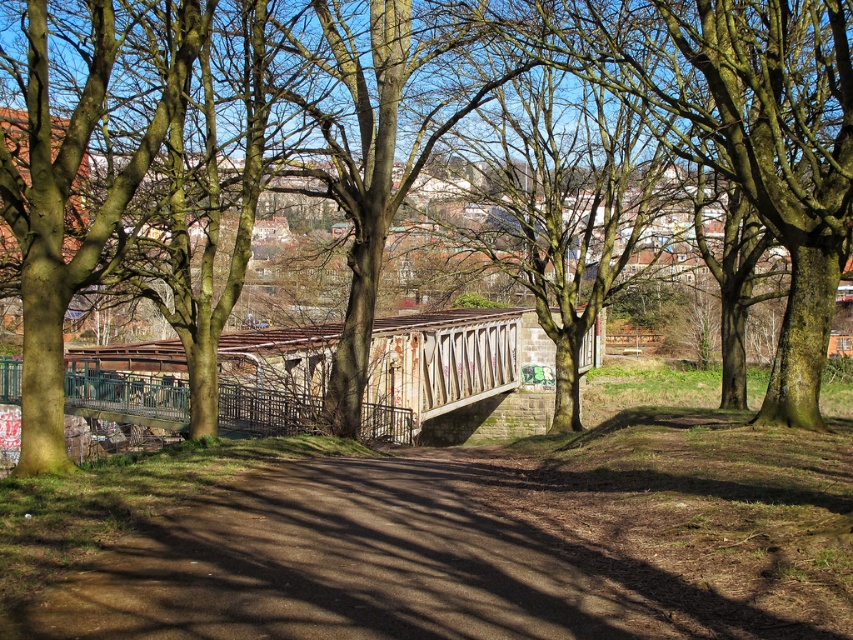
Question: Can you confirm if brown dirt path at center is positioned to the right of brown textured tree at center?

Choices:
 (A) no
 (B) yes

Answer: (A)

Question: Which point is farther to the camera?

Choices:
 (A) brown textured tree at center
 (B) brown dirt path at center

Answer: (A)

Question: Among these points, which one is farthest from the camera?

Choices:
 (A) (341, 477)
 (B) (778, 346)

Answer: (B)

Question: Can you confirm if brown dirt path at center is positioned above brown textured tree at center?

Choices:
 (A) yes
 (B) no

Answer: (B)

Question: Does brown dirt path at center come in front of brown textured tree at center?

Choices:
 (A) yes
 (B) no

Answer: (A)

Question: Which of the following is the closest to the observer?

Choices:
 (A) brown dirt path at center
 (B) brown textured tree at center

Answer: (A)